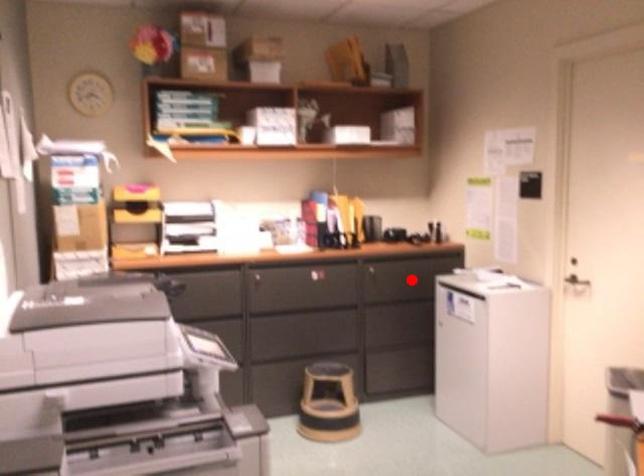
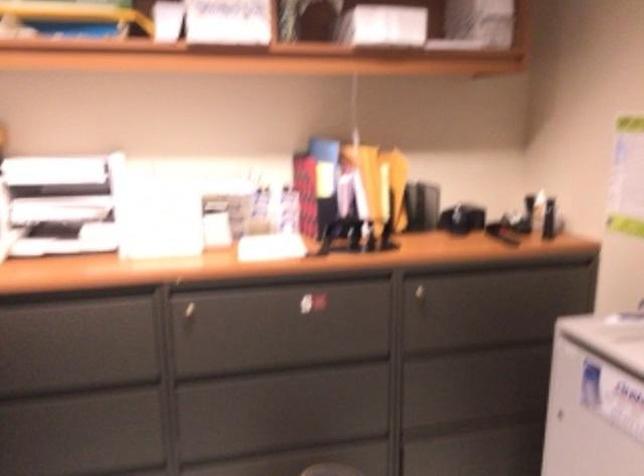
Where in the second image is the point corresponding to the highlighted location from the first image?

(489, 311)